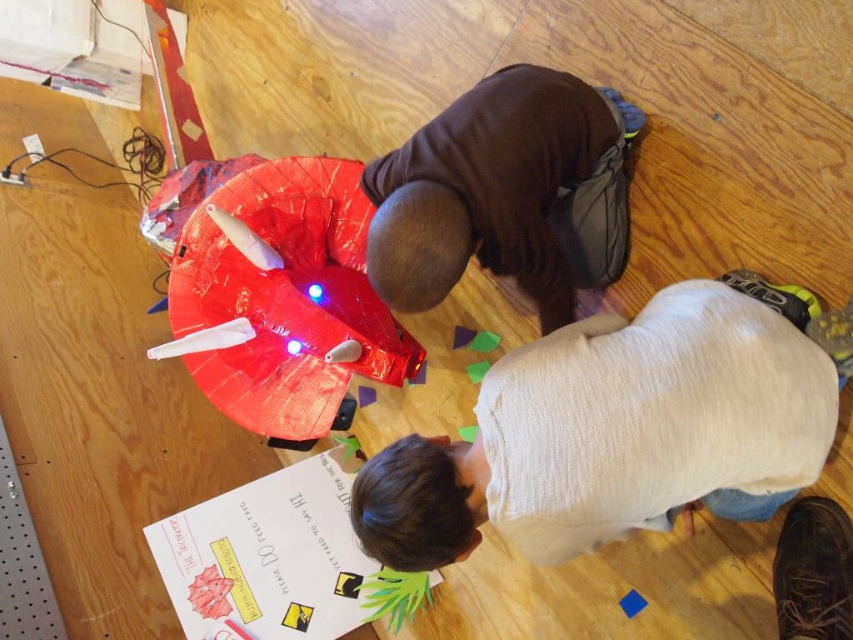
Who is higher up, light beige sweater at lower center or shiny plastic toy at center?

shiny plastic toy at center

Looking at this image, can you confirm if light beige sweater at lower center is bigger than shiny plastic toy at center?

No.

At what (x,y) coordinates should I click in order to perform the action: click on light beige sweater at lower center. Please return your answer as a coordinate pair (x, y). This screenshot has height=640, width=853. Looking at the image, I should click on (612, 435).

Does light beige sweater at lower center have a larger size compared to brown matte shirt at center?

Correct, light beige sweater at lower center is larger in size than brown matte shirt at center.

Image resolution: width=853 pixels, height=640 pixels. What are the coordinates of `light beige sweater at lower center` in the screenshot? It's located at (612, 435).

You are a GUI agent. You are given a task and a screenshot of the screen. Output one action in this format:
    pyautogui.click(x=<x>, y=<y>)
    Task: Click on the light beige sweater at lower center
    
    Given the screenshot: What is the action you would take?
    pyautogui.click(x=612, y=435)

Does brown matte shirt at center lie behind shiny plastic toy at center?

No.

Who is more forward, [579,83] or [262,432]?

Positioned in front is point [579,83].

Is point (602, 209) farther from viewer compared to point (248, 369)?

That is False.

Find the location of a particular element. This screenshot has height=640, width=853. brown matte shirt at center is located at coordinates (506, 193).